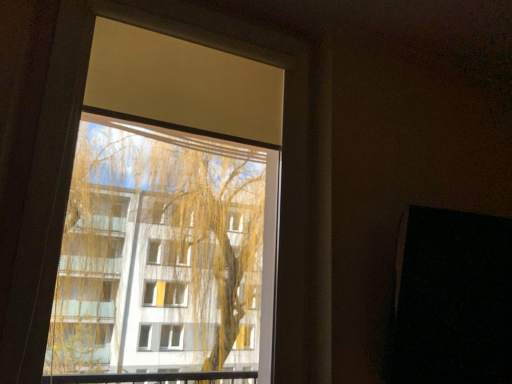
Find the location of a particular element. black matte screen door at right is located at coordinates (451, 299).

Based on the photo, measure the distance between black matte screen door at right and camera.

The distance of black matte screen door at right from camera is 3.94 feet.

Describe the element at coordinates (451, 299) in the screenshot. I see `black matte screen door at right` at that location.

Find the location of a particular element. transparent glass window at upper center is located at coordinates (71, 168).

What is the approximate width of transparent glass window at upper center?

transparent glass window at upper center is 3.99 inches in width.

Describe the element at coordinates (71, 168) in the screenshot. This screenshot has height=384, width=512. I see `transparent glass window at upper center` at that location.

Identify the location of black matte screen door at right. The image size is (512, 384). (451, 299).

Which object is positioned more to the right, black matte screen door at right or transparent glass window at upper center?

From the viewer's perspective, black matte screen door at right appears more on the right side.

Which is behind, black matte screen door at right or transparent glass window at upper center?

black matte screen door at right.

Does point (426, 258) come farther from viewer compared to point (61, 81)?

Yes, it is.

From the image's perspective, which is above, black matte screen door at right or transparent glass window at upper center?

From the image's view, transparent glass window at upper center is above.

From a real-world perspective, between black matte screen door at right and transparent glass window at upper center, who is vertically higher?

In real-world perspective, transparent glass window at upper center is above.

Which of these two, black matte screen door at right or transparent glass window at upper center, is thinner?

Thinner between the two is transparent glass window at upper center.

Can you confirm if black matte screen door at right is taller than transparent glass window at upper center?

No.

Who is bigger, black matte screen door at right or transparent glass window at upper center?

Bigger between the two is transparent glass window at upper center.

Is transparent glass window at upper center a part of black matte screen door at right?

No, transparent glass window at upper center is located outside of black matte screen door at right.

Is black matte screen door at right positioned far away from transparent glass window at upper center?

No, black matte screen door at right is not far away from transparent glass window at upper center.

Is black matte screen door at right aimed at transparent glass window at upper center?

No, black matte screen door at right is not turned towards transparent glass window at upper center.

The height and width of the screenshot is (384, 512). I want to click on screen door below the transparent glass window at upper center (from the image's perspective), so (451, 299).

Considering the relative positions of transparent glass window at upper center and black matte screen door at right in the image provided, is transparent glass window at upper center to the left of black matte screen door at right from the viewer's perspective?

Yes.

In the image, is transparent glass window at upper center positioned in front of or behind black matte screen door at right?

transparent glass window at upper center is in front of black matte screen door at right.

Is point (41, 283) closer or farther from the camera than point (401, 368)?

Point (41, 283) is closer to the camera than point (401, 368).

From the image's perspective, which is above, transparent glass window at upper center or black matte screen door at right?

From the image's view, transparent glass window at upper center is above.

From a real-world perspective, is transparent glass window at upper center physically above black matte screen door at right?

Yes, from a real-world perspective, transparent glass window at upper center is over black matte screen door at right

Between transparent glass window at upper center and black matte screen door at right, which one has larger width?

black matte screen door at right.

Can you confirm if transparent glass window at upper center is shorter than black matte screen door at right?

No, transparent glass window at upper center is not shorter than black matte screen door at right.

Looking at the image, does transparent glass window at upper center seem bigger or smaller compared to black matte screen door at right?

Clearly, transparent glass window at upper center is larger in size than black matte screen door at right.

Would you say transparent glass window at upper center is inside or outside black matte screen door at right?

The correct answer is: outside.

Is transparent glass window at upper center touching black matte screen door at right?

No, transparent glass window at upper center is not touching black matte screen door at right.

Is transparent glass window at upper center turned away from black matte screen door at right?

transparent glass window at upper center is not turned away from black matte screen door at right.

Consider the image. What's the angular difference between transparent glass window at upper center and black matte screen door at right's facing directions?

There is a 1.3-degree angle between the facing directions of transparent glass window at upper center and black matte screen door at right.

This screenshot has height=384, width=512. What are the coordinates of `screen door on the right of transparent glass window at upper center` in the screenshot? It's located at (451, 299).

At what (x,y) coordinates should I click in order to perform the action: click on window above the black matte screen door at right (from the image's perspective). Please return your answer as a coordinate pair (x, y). Image resolution: width=512 pixels, height=384 pixels. Looking at the image, I should click on (71, 168).

Where is `screen door on the right of the transparent glass window at upper center`? This screenshot has width=512, height=384. screen door on the right of the transparent glass window at upper center is located at coordinates (451, 299).